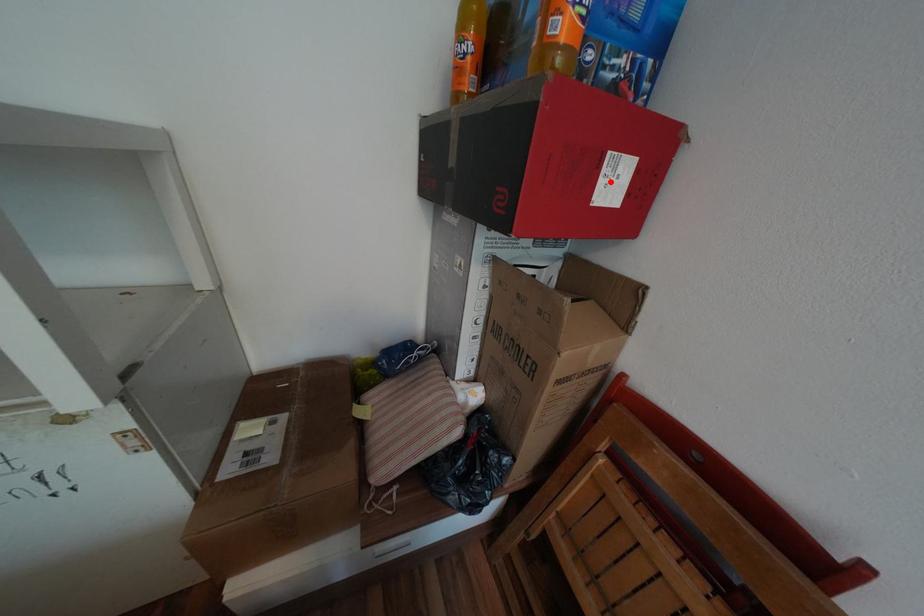
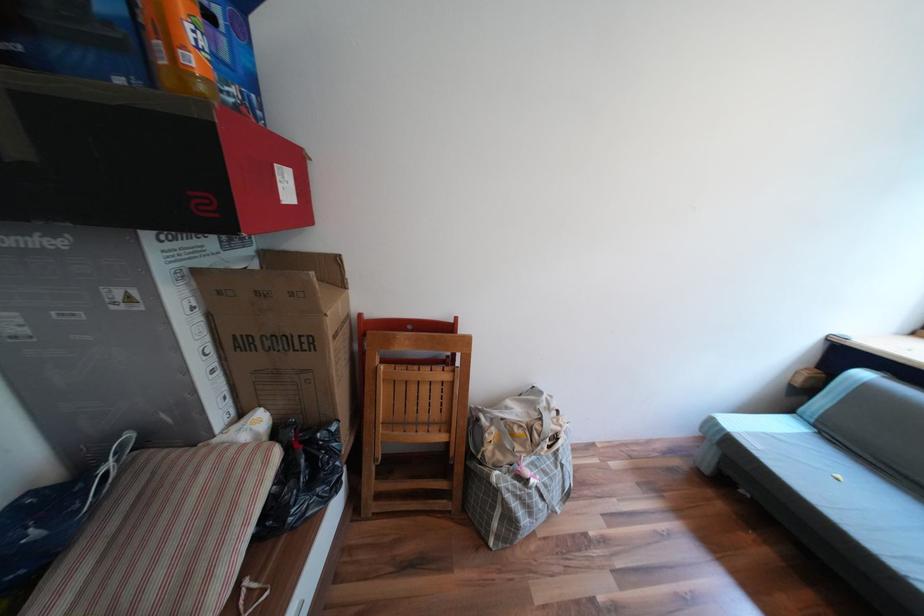
Locate, in the second image, the point that corresponds to the highlighted location in the first image.

(289, 185)